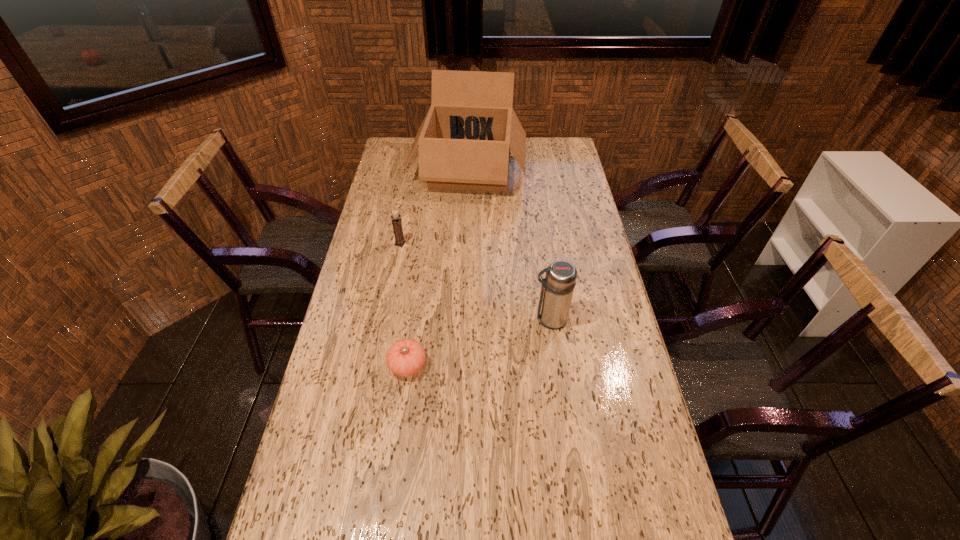
Find the location of `free space located with a handle on the side of the third farthest object`. free space located with a handle on the side of the third farthest object is located at coordinates (488, 319).

You are a GUI agent. You are given a task and a screenshot of the screen. Output one action in this format:
    pyautogui.click(x=<x>, y=<y>)
    Task: Click on the free space located with a handle on the side of the third farthest object
    
    Given the screenshot: What is the action you would take?
    pyautogui.click(x=500, y=319)

Where is `free region located on the right of the candle holder`? free region located on the right of the candle holder is located at coordinates (436, 244).

This screenshot has height=540, width=960. I want to click on vacant area situated on the back of the tomato, so click(x=418, y=294).

This screenshot has width=960, height=540. Find the location of `object that is at the far edge`. object that is at the far edge is located at coordinates (465, 139).

The width and height of the screenshot is (960, 540). In order to click on box located at the left edge in this screenshot , I will do `click(465, 139)`.

This screenshot has height=540, width=960. In order to click on candle holder that is at the left edge in this screenshot , I will do `click(397, 226)`.

I want to click on object located at the right edge, so click(557, 288).

Locate an element on the screen. The width and height of the screenshot is (960, 540). object at the far left corner is located at coordinates (465, 139).

I want to click on vacant space at the left edge, so click(379, 314).